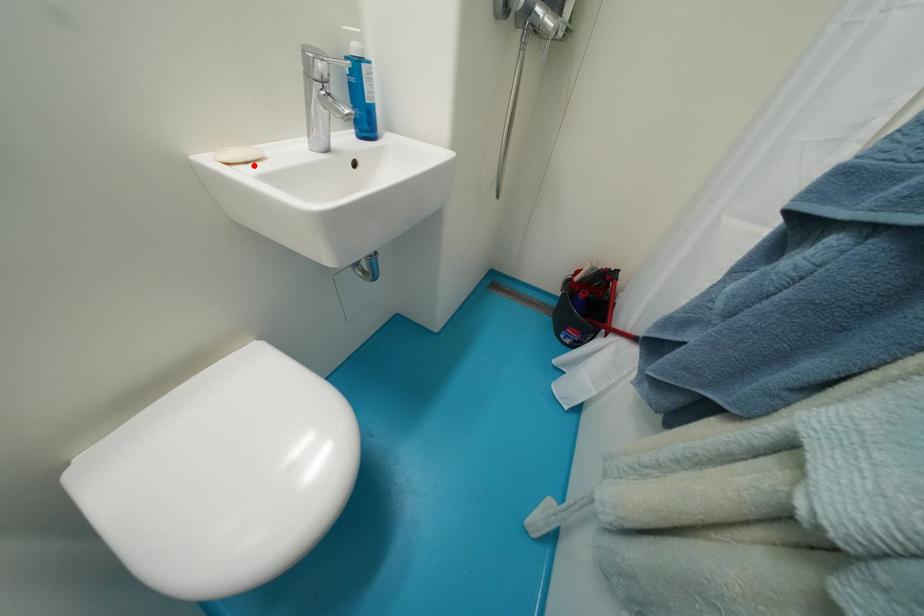
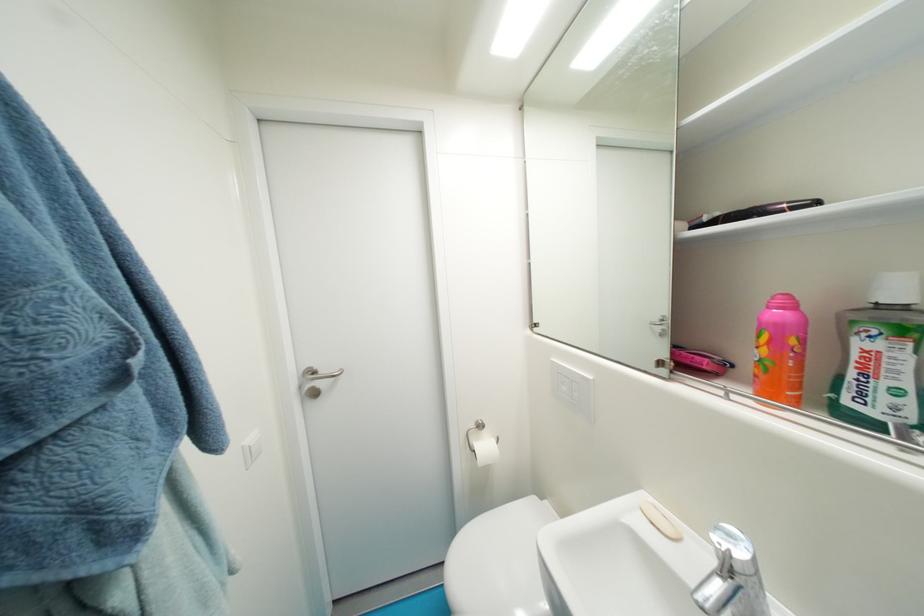
Locate, in the second image, the point that corresponds to the highlighted location in the first image.

(659, 525)